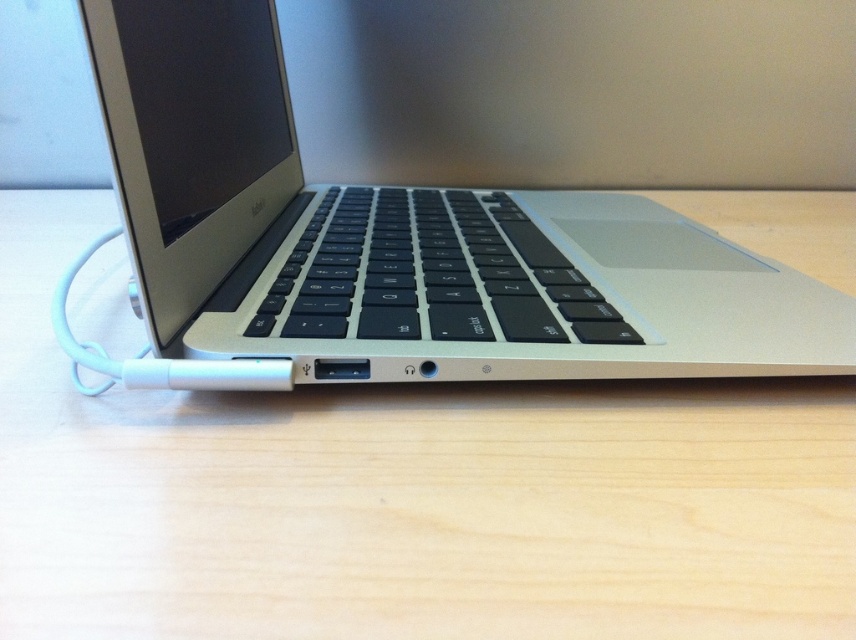
Does light wood table at center have a smaller size compared to silver metallic laptop at center?

No.

Which is in front, point (560, 403) or point (116, 13)?

Point (116, 13) is in front.

In order to click on light wood table at center in this screenshot , I will do `click(405, 496)`.